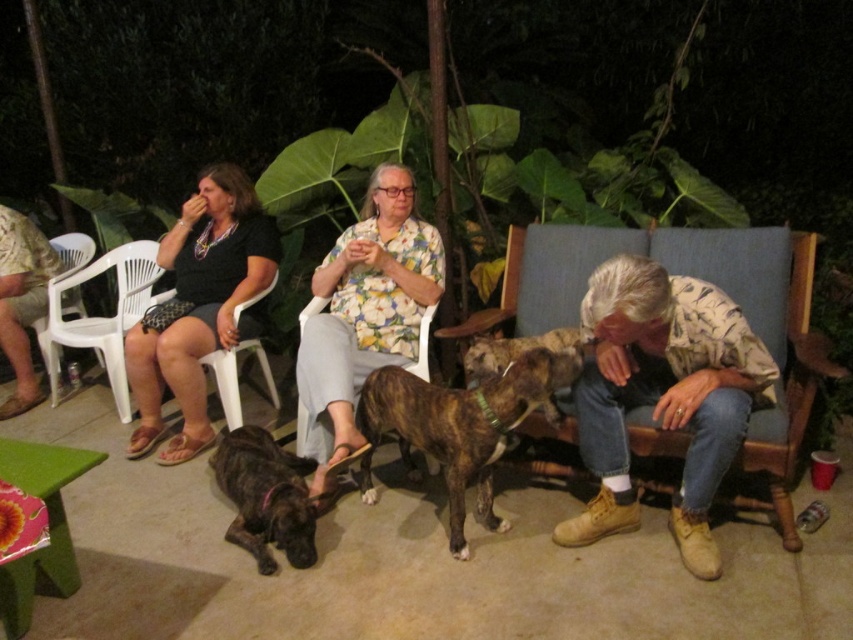
Question: Is leather boots at lower right positioned at the back of brindle fur dog at lower left?

Choices:
 (A) no
 (B) yes

Answer: (A)

Question: Is matte black shirt at left below white plastic chair at lower left?

Choices:
 (A) yes
 (B) no

Answer: (A)

Question: Among these objects, which one is farthest from the camera?

Choices:
 (A) matte plastic chair at left
 (B) white plastic chair at lower left

Answer: (B)

Question: Which object is the closest to the white plastic chair at lower left?

Choices:
 (A) braided fur dog at lower center
 (B) wooden rocking chair at center
 (C) leather boots at lower right
 (D) matte plastic chair at left

Answer: (D)

Question: Which point appears farthest from the camera in this image?

Choices:
 (A) (491, 342)
 (B) (27, 353)

Answer: (B)

Question: Is white plastic chair at left above braided fur dog at lower center?

Choices:
 (A) yes
 (B) no

Answer: (A)